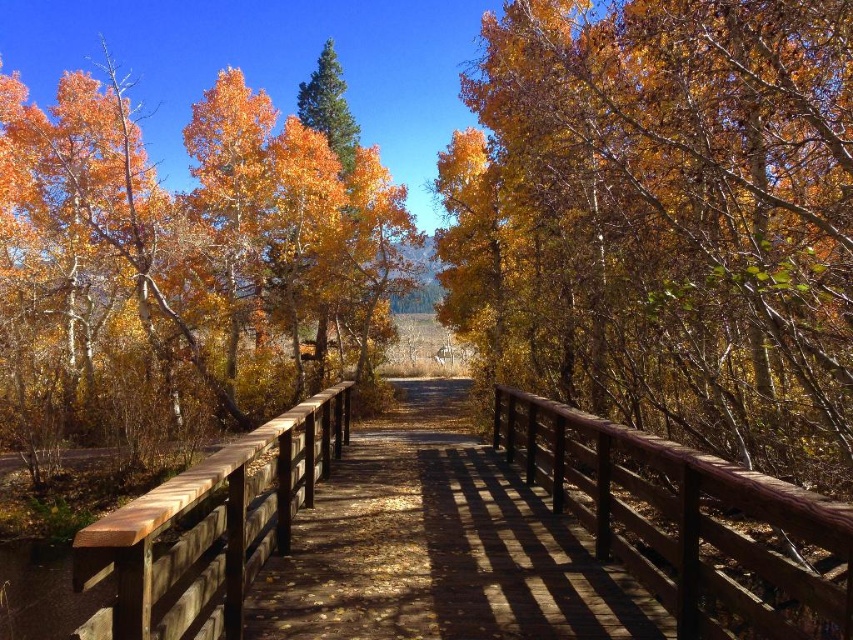
Question: Which of the following is the farthest from the observer?

Choices:
 (A) orange leaves at left
 (B) golden-brown bark tree at center

Answer: (A)

Question: Estimate the real-world distances between objects in this image. Which object is closer to the orange leaves at left?

Choices:
 (A) golden-brown bark tree at center
 (B) brown wooden rail at center
 (C) wooden bridge at center

Answer: (A)

Question: Which is nearer to the orange leaves at left?

Choices:
 (A) wooden bridge at center
 (B) brown wooden rail at center

Answer: (A)

Question: Is golden-brown bark tree at center thinner than wooden bridge at center?

Choices:
 (A) no
 (B) yes

Answer: (B)

Question: Is orange leaves at left to the left of brown wooden rail at center from the viewer's perspective?

Choices:
 (A) yes
 (B) no

Answer: (A)

Question: Observing the image, what is the correct spatial positioning of golden-brown bark tree at center in reference to brown wooden rail at center?

Choices:
 (A) left
 (B) right

Answer: (B)